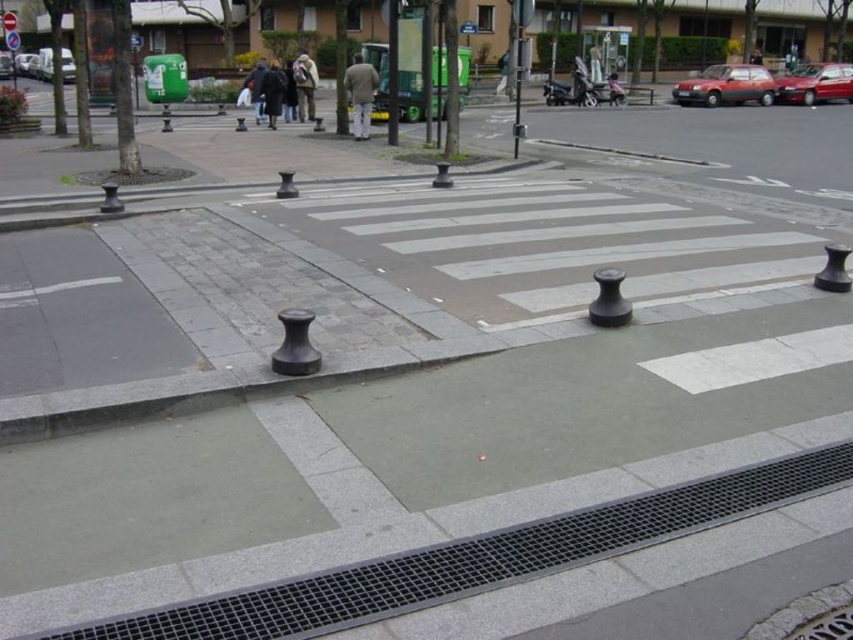
Question: Which point appears closest to the camera in this image?

Choices:
 (A) (305, 115)
 (B) (827, 67)
 (C) (45, 60)

Answer: (A)

Question: From the image, what is the correct spatial relationship of shiny red car at upper right in relation to dark gray jacket at center?

Choices:
 (A) above
 (B) below

Answer: (A)

Question: Can you confirm if shiny red car at upper right is bigger than metallic red sedan at upper right?

Choices:
 (A) yes
 (B) no

Answer: (A)

Question: Among these objects, which one is farthest from the camera?

Choices:
 (A) light brown fabric jacket at center
 (B) light beige fabric jacket at center
 (C) shiny red car at upper right
 (D) metallic red sedan at upper right

Answer: (D)

Question: Which object is closer to the camera taking this photo?

Choices:
 (A) light brown fabric jacket at center
 (B) shiny red car at upper right

Answer: (A)

Question: Can you confirm if metallic red sedan at upper right is positioned to the right of metallic silver car at upper left?

Choices:
 (A) no
 (B) yes

Answer: (B)